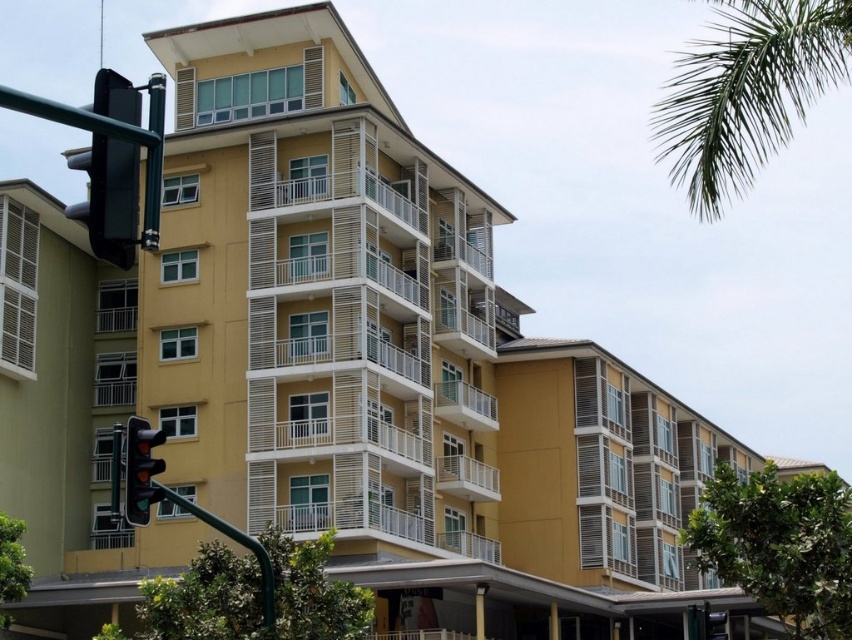
You are standing in front of the building and notice the green leafy palm at upper right and the matte black traffic light at left. Which object is positioned to the right side of the other?

The green leafy palm at upper right is positioned to the right of the matte black traffic light at left.

You are a city planner analyzing this area. You need to determine which object occupies more visual space in the image between the green leafy palm at upper right and the matte black traffic light at left. Based on the scene description, which one is larger?

The green leafy palm at upper right has a larger size compared to the matte black traffic light at left, so it occupies more visual space in the image.